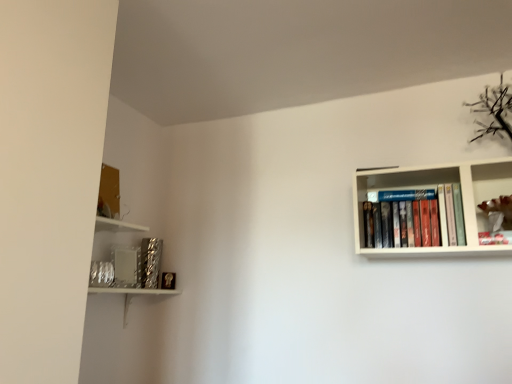
Question: Considering the relative sizes of metallic textured book at lower left and hardcover books at upper right in the image provided, is metallic textured book at lower left wider than hardcover books at upper right?

Choices:
 (A) yes
 (B) no

Answer: (B)

Question: Is metallic textured book at lower left not inside hardcover books at upper right?

Choices:
 (A) yes
 (B) no

Answer: (A)

Question: Could you tell me if metallic textured book at lower left is facing hardcover books at upper right?

Choices:
 (A) no
 (B) yes

Answer: (A)

Question: From a real-world perspective, is metallic textured book at lower left over hardcover books at upper right?

Choices:
 (A) yes
 (B) no

Answer: (B)

Question: Considering the relative sizes of metallic textured book at lower left and hardcover books at upper right in the image provided, is metallic textured book at lower left bigger than hardcover books at upper right?

Choices:
 (A) no
 (B) yes

Answer: (A)

Question: Is metallic textured book at lower left smaller than hardcover books at upper right?

Choices:
 (A) no
 (B) yes

Answer: (B)

Question: Considering the relative sizes of hardcover books at upper right and metallic textured book at lower left in the image provided, is hardcover books at upper right taller than metallic textured book at lower left?

Choices:
 (A) no
 (B) yes

Answer: (A)

Question: Does hardcover books at upper right have a lesser width compared to metallic textured book at lower left?

Choices:
 (A) yes
 (B) no

Answer: (B)

Question: Is hardcover books at upper right positioned in front of metallic textured book at lower left?

Choices:
 (A) yes
 (B) no

Answer: (A)

Question: Is there a large distance between hardcover books at upper right and metallic textured book at lower left?

Choices:
 (A) no
 (B) yes

Answer: (B)

Question: From the image's perspective, is hardcover books at upper right located above metallic textured book at lower left?

Choices:
 (A) no
 (B) yes

Answer: (B)

Question: Considering the relative sizes of hardcover books at upper right and metallic textured book at lower left in the image provided, is hardcover books at upper right smaller than metallic textured book at lower left?

Choices:
 (A) no
 (B) yes

Answer: (A)

Question: Does hardcover books at upper right have a lesser height compared to metallic silver frame at upper right?

Choices:
 (A) no
 (B) yes

Answer: (A)